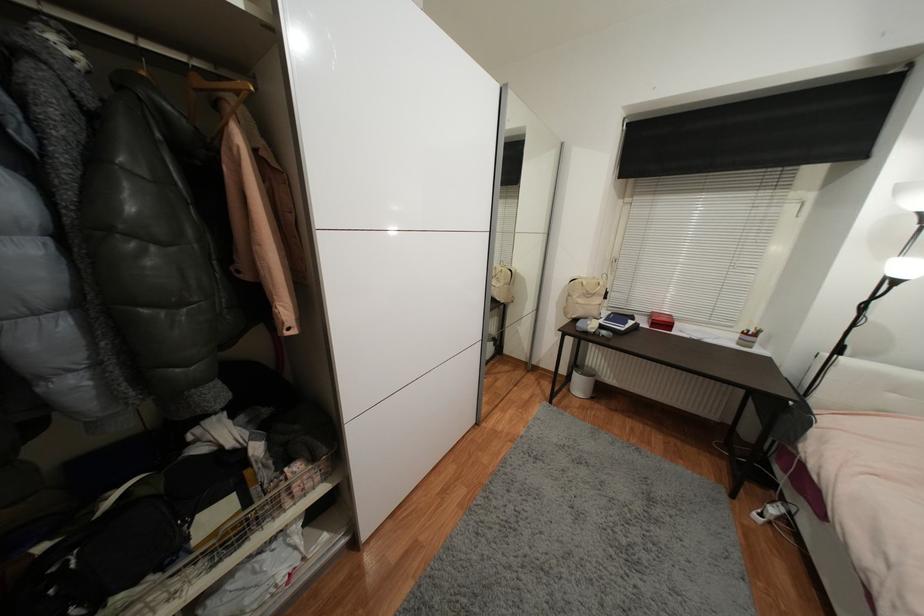
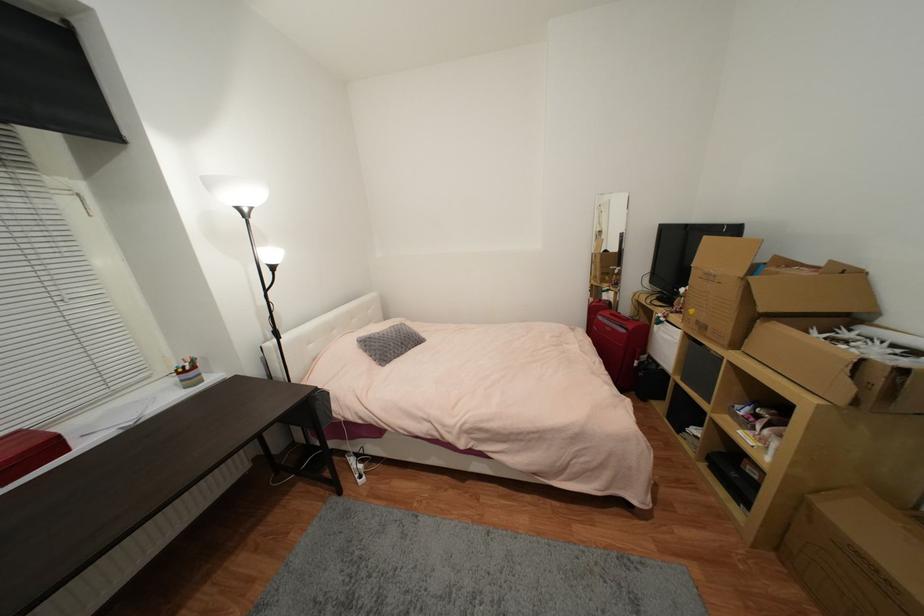
The first image is from the beginning of the video and the second image is from the end. How did the camera likely rotate when shooting the video?

The rotation direction of the camera is right-down.